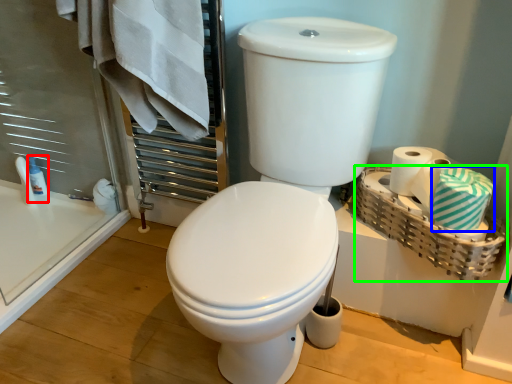
Question: Which object is positioned closest to toiletry (highlighted by a red box)? Select from bath towel (highlighted by a blue box) and basket (highlighted by a green box).

Choices:
 (A) bath towel
 (B) basket

Answer: (B)